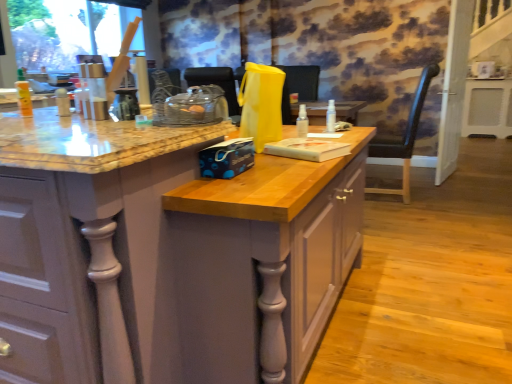
Where is `vacant space in black leather chair at right (from a real-world perspective)`? The image size is (512, 384). vacant space in black leather chair at right (from a real-world perspective) is located at coordinates (392, 197).